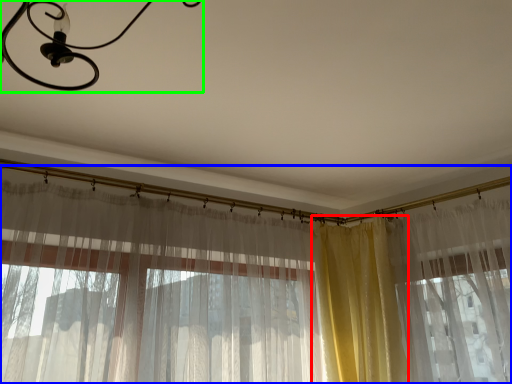
Question: Which object is the closest to the curtain (highlighted by a red box)? Choose among these: curtain (highlighted by a blue box) or light fixture (highlighted by a green box).

Choices:
 (A) curtain
 (B) light fixture

Answer: (A)